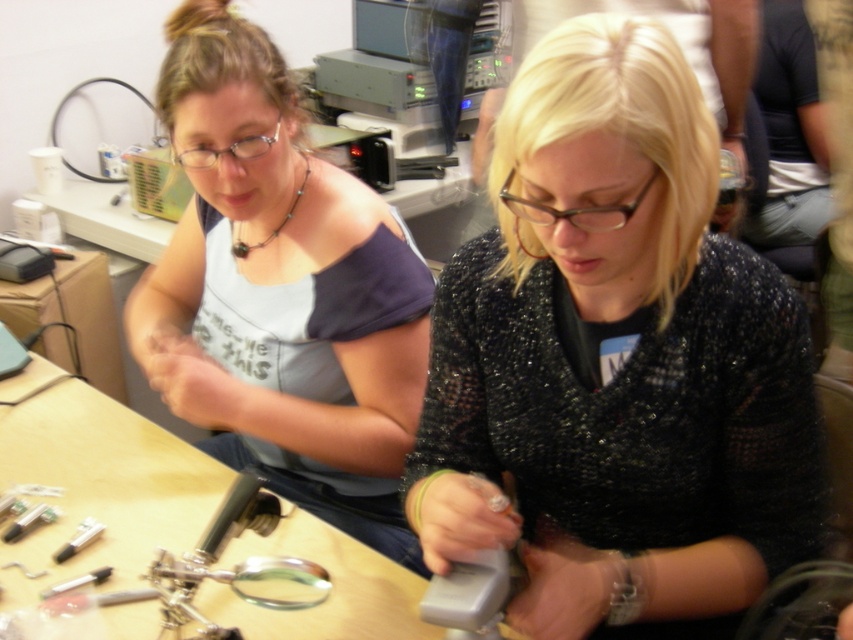
You are a photographer standing in front of the scene. You want to take a picture of the wooden table at center without the matte blue tank top at upper left overlapping it. Is this possible based on their heights?

The matte blue tank top at upper left is taller than wooden table at center, so it will overlap the table in the photo unless you adjust your angle or position to avoid it.

Based on the scene description, which object, the matte blue tank top at upper left or the wooden table at center, is bigger in size?

The matte blue tank top at upper left is larger in size compared to the wooden table at center according to the description.

You are standing at the point marked as point (643, 508) in the workshop. You need to pick up a tool that is exactly 40 inches away from the camera. Is the tool within reach from your current position?

The point (643, 508) is 37.56 inches away from the camera. Since the tool is 40 inches away from the camera, it is 2.44 inches further away than your current position. Therefore, the tool is not within reach from your current position.